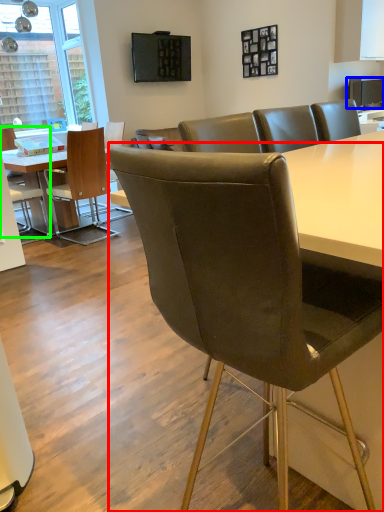
Question: Based on their relative distances, which object is farther from chair (highlighted by a red box)? Choose from television (highlighted by a blue box) and chair (highlighted by a green box).

Choices:
 (A) television
 (B) chair

Answer: (A)